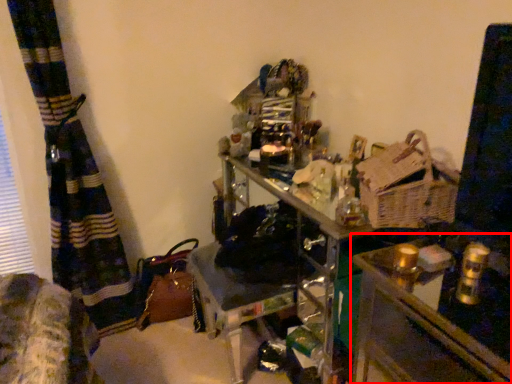
Question: Where is table (annotated by the red box) located in relation to basket in the image?

Choices:
 (A) right
 (B) left

Answer: (A)